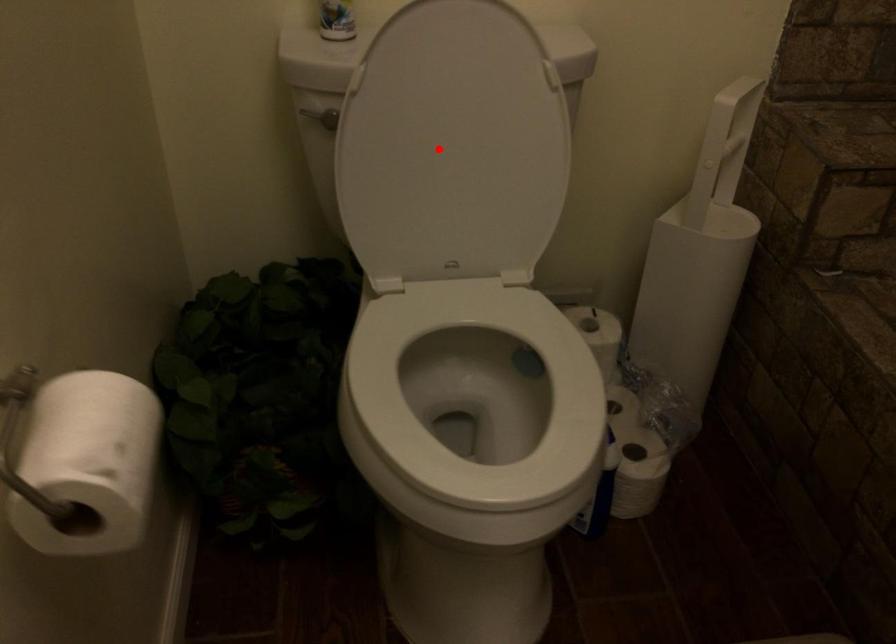
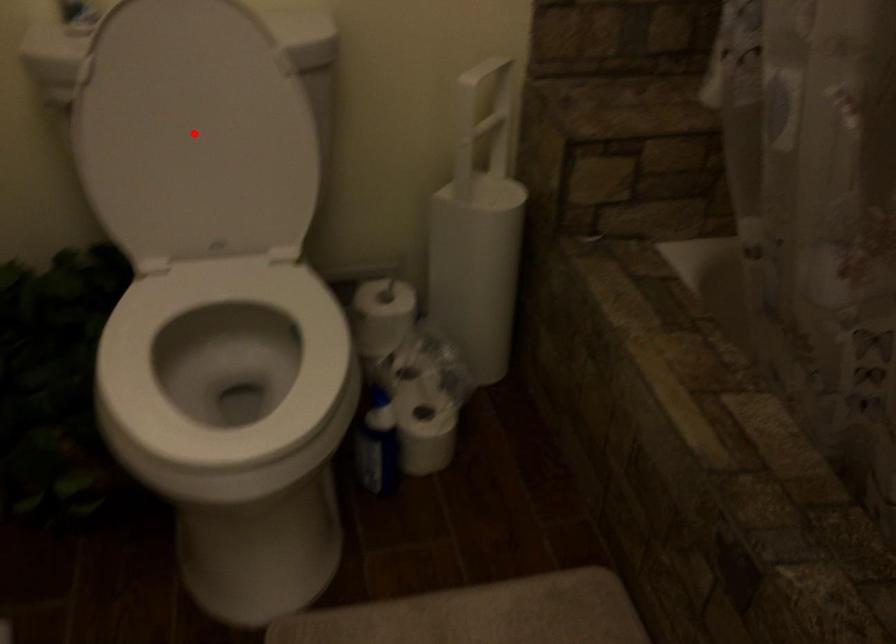
Based on the photo, I am providing you with two images of the same scene from different viewpoints. A red point is marked on the first image and another point is marked on the second image. Is the marked point in image1 the same physical position as the marked point in image2?

Yes